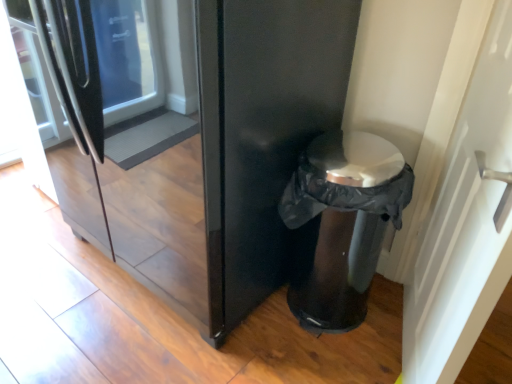
This screenshot has width=512, height=384. I want to click on white glossy door handle at right, so click(465, 223).

Describe the element at coordinates (465, 223) in the screenshot. I see `white glossy door handle at right` at that location.

Locate an element on the screen. This screenshot has height=384, width=512. white glossy door handle at right is located at coordinates (465, 223).